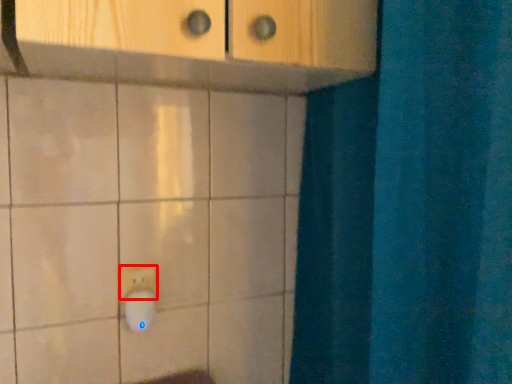
Question: From the image's perspective, where is light switch (annotated by the red box) located relative to knob?

Choices:
 (A) above
 (B) below

Answer: (A)